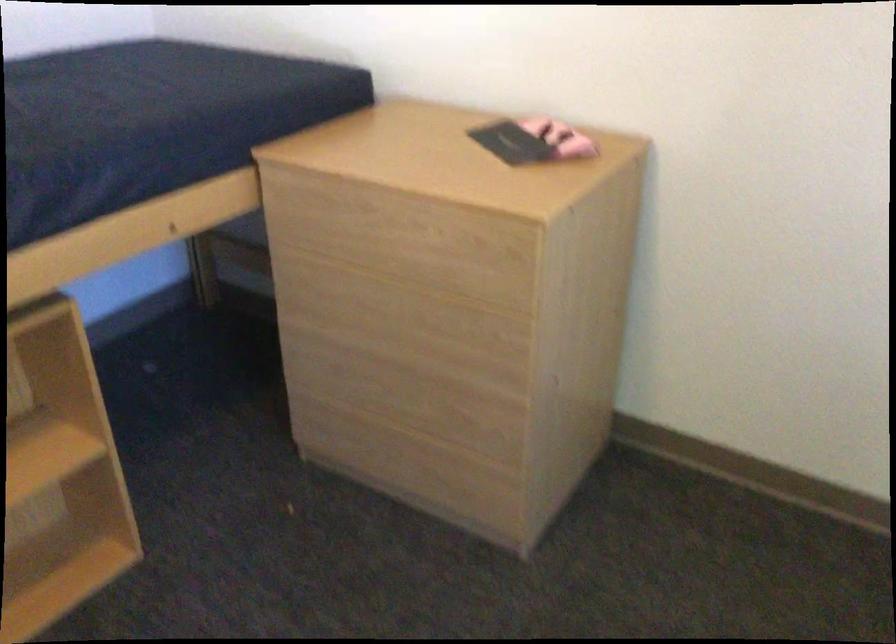
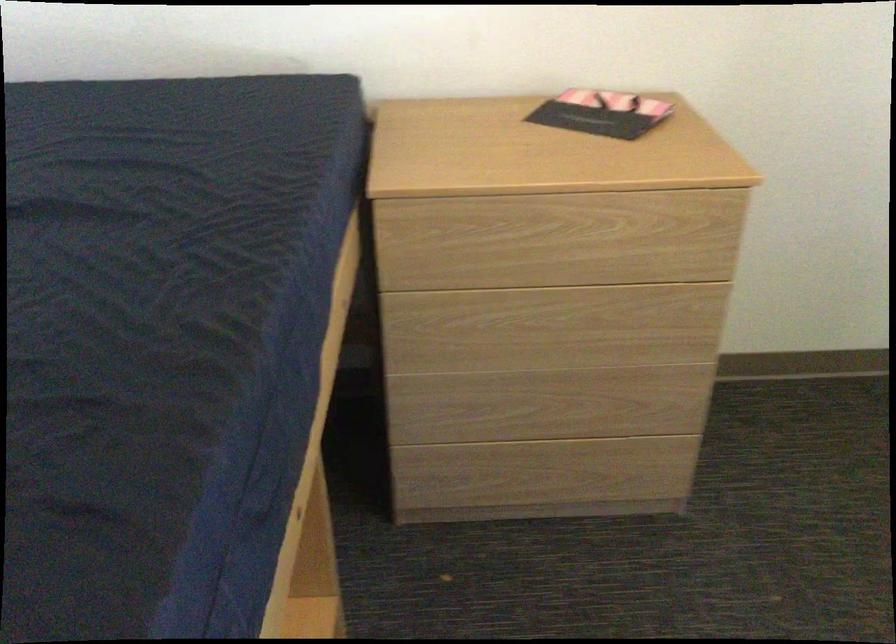
Where in the second image is the point corresponding to (x=363, y=344) from the first image?

(518, 368)